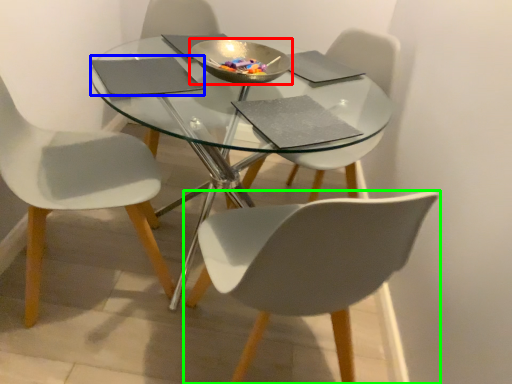
Question: Estimate the real-world distances between objects in this image. Which object is closer to bowl (highlighted by a red box), pad (highlighted by a blue box) or chair (highlighted by a green box)?

Choices:
 (A) pad
 (B) chair

Answer: (A)